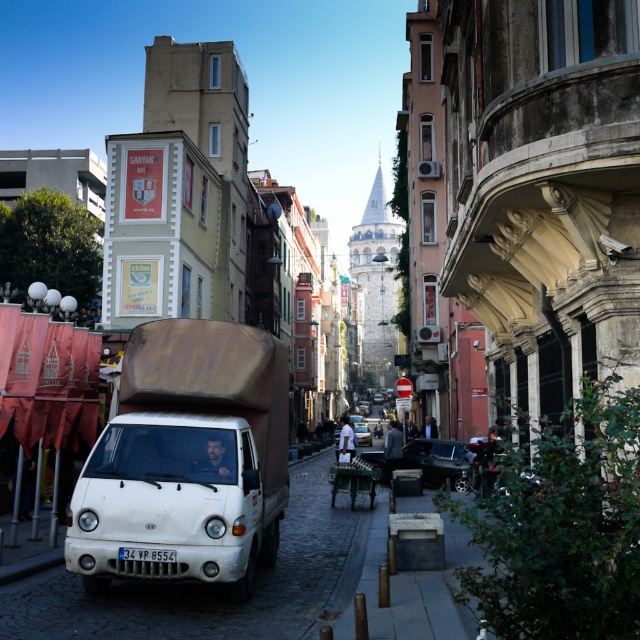
You are a pedestrian standing on the street and want to cross to the other side. There is a shiny black car at right and a white matte car at center. Which car is nearer to you as you decide to cross?

The shiny black car at right is closer to the viewer than the white matte car at center, so it is nearer to you as you decide to cross.

You are a delivery driver who needs to park your shiny black car at right near the white Hyundai truck with the license plate 34 VP 8554. Based on the scene, can you safely park your car in the available space next to the truck without blocking the cobblestone street?

The shiny black car at right is located at point (438, 460), which is not near the white Hyundai truck. Therefore, you cannot park there safely without blocking the street.